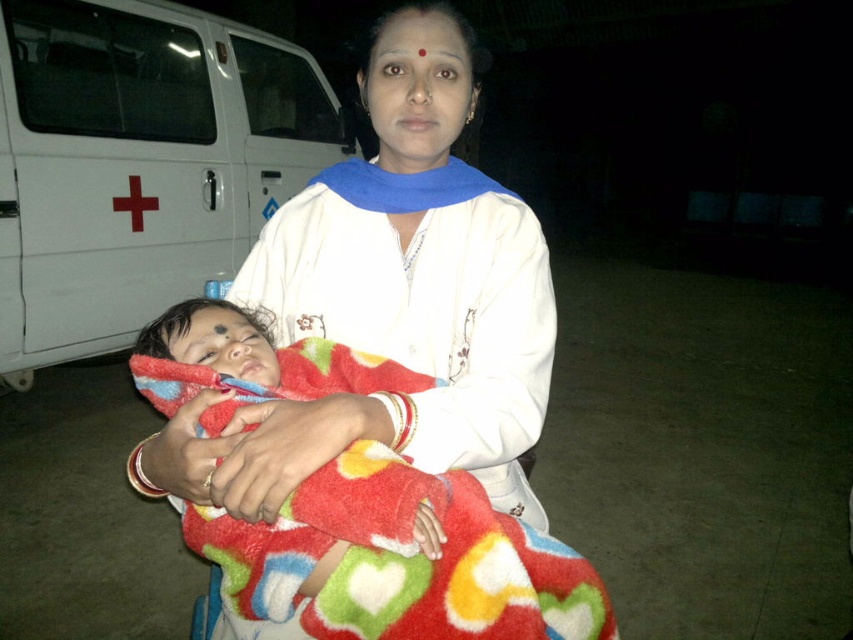
You are a first responder trying to reach the white soft cloth at center to check on the child. The white matte van at left is blocking your path. Can you walk around the van to access the cloth?

The white matte van at left is located above the white soft cloth at center, so it is not blocking the path. You can walk around the van to access the white soft cloth at center.

You are a first responder at the scene. You see the white soft cloth at center and the fluffy multicolored blanket at center. Which item is narrower in width?

The white soft cloth at center has a lesser width compared to the fluffy multicolored blanket at center, so the white soft cloth at center is narrower in width.